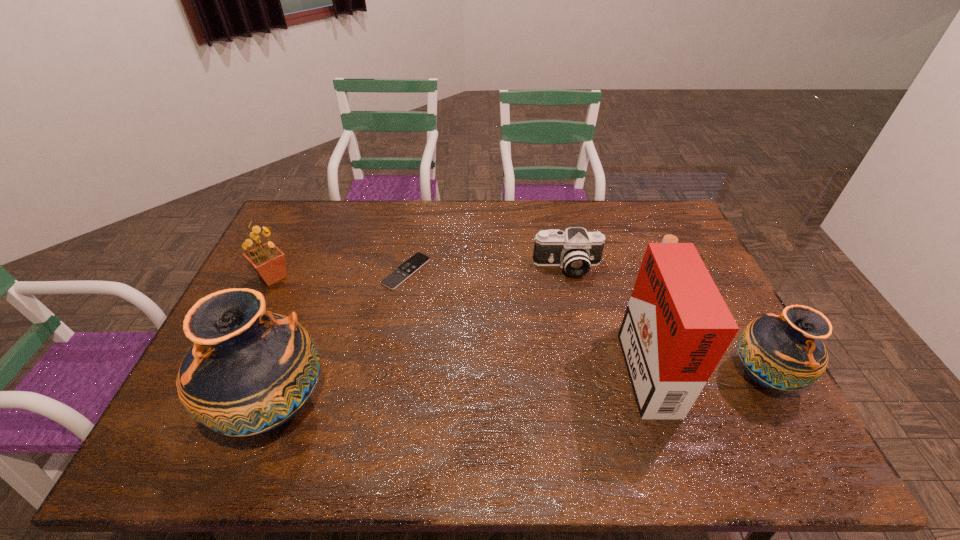
Locate an element on the screen. The height and width of the screenshot is (540, 960). vacant space located on the right of the remote control is located at coordinates (537, 272).

Image resolution: width=960 pixels, height=540 pixels. In order to click on free region located at the front of the sunflower with flowers visible in this screenshot , I will do `click(374, 276)`.

This screenshot has height=540, width=960. Find the location of `blank area located 0.240m on the front of the fifth tallest object`. blank area located 0.240m on the front of the fifth tallest object is located at coordinates (582, 339).

Find the location of a particular element. The image size is (960, 540). vacant area situated 0.130m on the front-facing side of the cigarette case is located at coordinates (577, 364).

Image resolution: width=960 pixels, height=540 pixels. I want to click on vacant space located on the front-facing side of the cigarette case, so click(x=595, y=364).

This screenshot has width=960, height=540. I want to click on vacant region located on the front-facing side of the cigarette case, so click(x=524, y=364).

You are a GUI agent. You are given a task and a screenshot of the screen. Output one action in this format:
    pyautogui.click(x=<x>, y=<y>)
    Task: Click on the cigarette case that is at the near edge
    The height and width of the screenshot is (540, 960).
    Given the screenshot: What is the action you would take?
    pyautogui.click(x=676, y=328)

The image size is (960, 540). Find the location of `pottery located in the left edge section of the desktop`. pottery located in the left edge section of the desktop is located at coordinates (249, 371).

Locate an element on the screen. sunflower at the left edge is located at coordinates 268,261.

Image resolution: width=960 pixels, height=540 pixels. What are the coordinates of `object located in the right edge section of the desktop` in the screenshot? It's located at (785, 352).